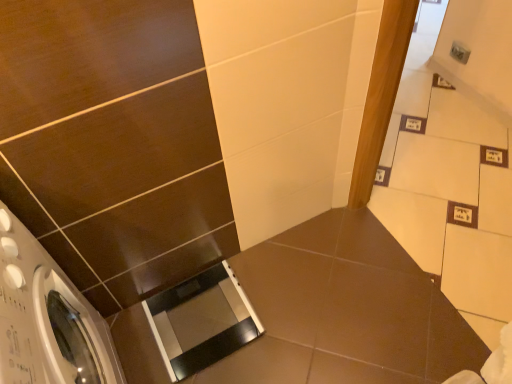
In order to click on free space above black glossy scale at lower center (from a real-world perspective) in this screenshot , I will do `click(294, 315)`.